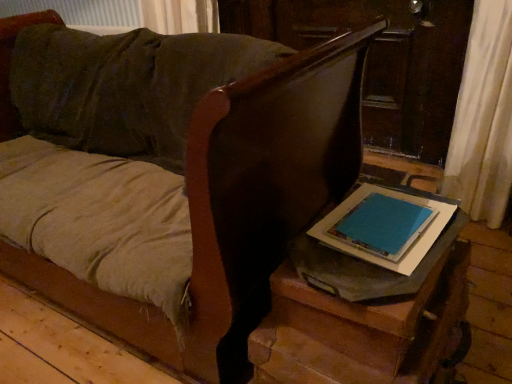
Question: Does wooden side table at lower right appear on the left side of blue matte tablet at center?

Choices:
 (A) yes
 (B) no

Answer: (A)

Question: Would you say wooden side table at lower right is outside blue matte tablet at center?

Choices:
 (A) yes
 (B) no

Answer: (A)

Question: Does wooden side table at lower right appear on the right side of blue matte tablet at center?

Choices:
 (A) no
 (B) yes

Answer: (A)

Question: Is wooden side table at lower right thinner than blue matte tablet at center?

Choices:
 (A) no
 (B) yes

Answer: (A)

Question: Considering the relative sizes of wooden side table at lower right and blue matte tablet at center in the image provided, is wooden side table at lower right taller than blue matte tablet at center?

Choices:
 (A) yes
 (B) no

Answer: (A)

Question: From a real-world perspective, is blue matte tablet at center above or below matte gray table at lower right?

Choices:
 (A) below
 (B) above

Answer: (B)

Question: Is blue matte tablet at center inside or outside of matte gray table at lower right?

Choices:
 (A) outside
 (B) inside

Answer: (B)

Question: Based on their sizes in the image, would you say blue matte tablet at center is bigger or smaller than matte gray table at lower right?

Choices:
 (A) big
 (B) small

Answer: (B)

Question: Is blue matte tablet at center taller or shorter than matte gray table at lower right?

Choices:
 (A) short
 (B) tall

Answer: (A)

Question: Does point (262, 354) appear closer or farther from the camera than point (263, 261)?

Choices:
 (A) closer
 (B) farther

Answer: (A)

Question: From their relative heights in the image, would you say matte gray table at lower right is taller or shorter than wooden side table at lower right?

Choices:
 (A) tall
 (B) short

Answer: (B)

Question: Visually, is matte gray table at lower right positioned to the left or to the right of wooden side table at lower right?

Choices:
 (A) left
 (B) right

Answer: (B)

Question: Is matte gray table at lower right wider or thinner than wooden side table at lower right?

Choices:
 (A) wide
 (B) thin

Answer: (B)

Question: Considering their positions, is blue matte tablet at center located in front of or behind wooden side table at lower right?

Choices:
 (A) front
 (B) behind

Answer: (B)

Question: From a real-world perspective, is blue matte tablet at center physically located above or below wooden side table at lower right?

Choices:
 (A) below
 (B) above

Answer: (B)